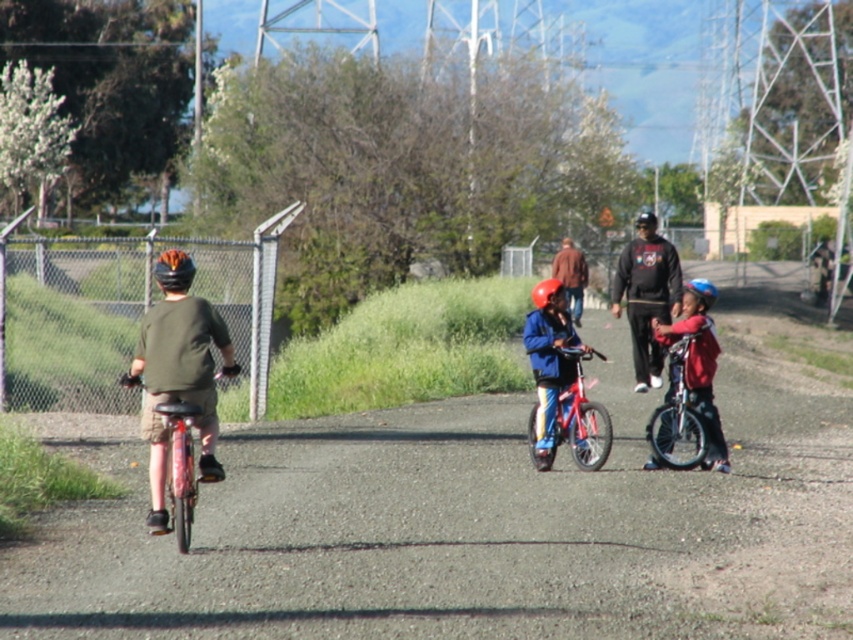
Question: Does shiny red helmet at center have a smaller size compared to blue matte helmet at upper center?

Choices:
 (A) yes
 (B) no

Answer: (A)

Question: Does blue matte helmet at center appear over blue matte helmet at upper center?

Choices:
 (A) yes
 (B) no

Answer: (B)

Question: Does matte blue jacket at center have a greater width compared to blue matte helmet at upper center?

Choices:
 (A) no
 (B) yes

Answer: (A)

Question: Which point appears farthest from the camera in this image?

Choices:
 (A) click(640, 228)
 (B) click(708, 296)
 (C) click(166, 520)
 (D) click(656, 376)

Answer: (D)

Question: Which of the following is the farthest from the observer?

Choices:
 (A) (699, 288)
 (B) (166, 280)

Answer: (A)

Question: Based on their relative distances, which object is nearer to the shiny red bicycle at center?

Choices:
 (A) blue matte helmet at center
 (B) dark gray sweatshirt at center
 (C) shiny red helmet at center

Answer: (C)